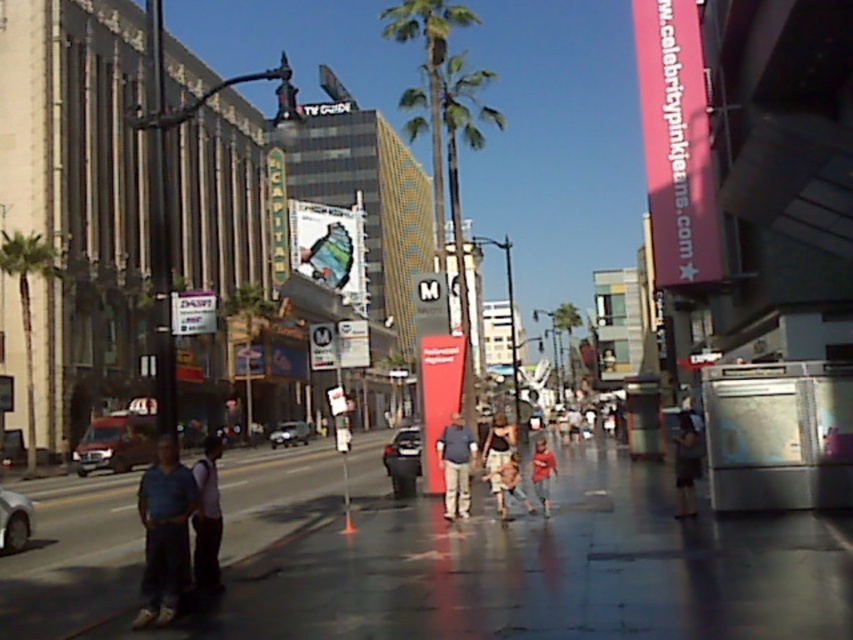
You are a photographer standing in the middle of the street. You notice a light brown fabric dress at center and a shiny silver sedan at center. Which object is closer to you?

The light brown fabric dress at center is closer to you because it is positioned over the shiny silver sedan at center.

You are standing at the center of the street and want to find the green leafy palm tree at left. According to the coordinates provided, in which direction should you look to locate it?

The green leafy palm tree at left is located at coordinates point (27, 307). Since the x coordinate is 0.480, which is close to 0.5, and the y coordinate is 0.033, which is near the bottom of the image, you should look to your left and slightly downward to find it.